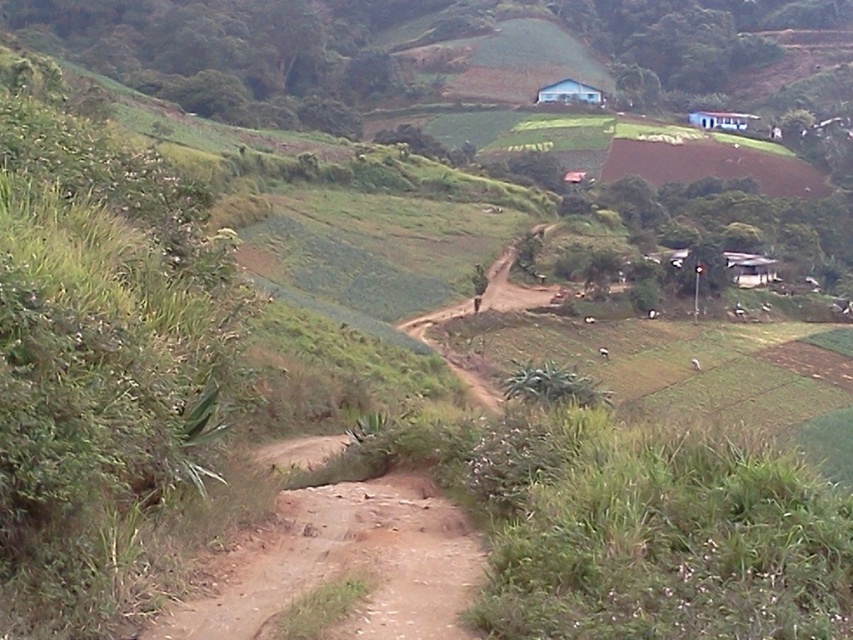
Between dusty brown dirt track at center and white matte hut at upper center, which one is positioned lower?

Positioned lower is dusty brown dirt track at center.

Can you confirm if dusty brown dirt track at center is shorter than white matte hut at upper center?

Correct, dusty brown dirt track at center is not as tall as white matte hut at upper center.

Which is behind, point (310, 570) or point (556, 90)?

Positioned behind is point (556, 90).

Locate an element on the screen. The image size is (853, 640). dusty brown dirt track at center is located at coordinates (343, 564).

Between white matte hut at upper center and white corrugated metal hut at upper center, which one has less height?

Standing shorter between the two is white matte hut at upper center.

Does white matte hut at upper center have a lesser height compared to white corrugated metal hut at upper center?

Correct, white matte hut at upper center is not as tall as white corrugated metal hut at upper center.

What do you see at coordinates (569, 92) in the screenshot?
I see `white matte hut at upper center` at bounding box center [569, 92].

Where is `white matte hut at upper center`? Image resolution: width=853 pixels, height=640 pixels. white matte hut at upper center is located at coordinates (569, 92).

Does dusty brown dirt track at center have a greater height compared to white corrugated metal hut at upper center?

In fact, dusty brown dirt track at center may be shorter than white corrugated metal hut at upper center.

Does dusty brown dirt track at center lie in front of white corrugated metal hut at upper center?

Yes, it is in front of white corrugated metal hut at upper center.

Is point (442, 534) positioned in front of point (706, 113)?

Yes, it is in front of point (706, 113).

The height and width of the screenshot is (640, 853). I want to click on dusty brown dirt track at center, so click(343, 564).